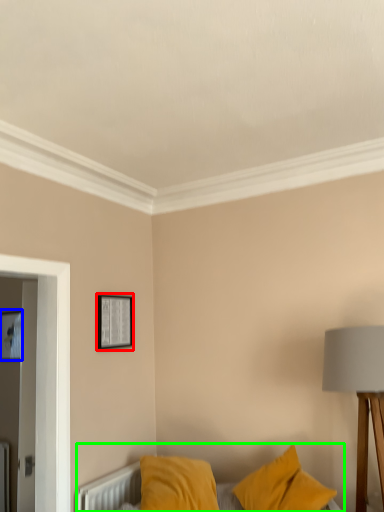
Question: Which object is positioned closest to picture frame (highlighted by a red box)? Select from picture frame (highlighted by a blue box) and bed (highlighted by a green box).

Choices:
 (A) picture frame
 (B) bed

Answer: (B)